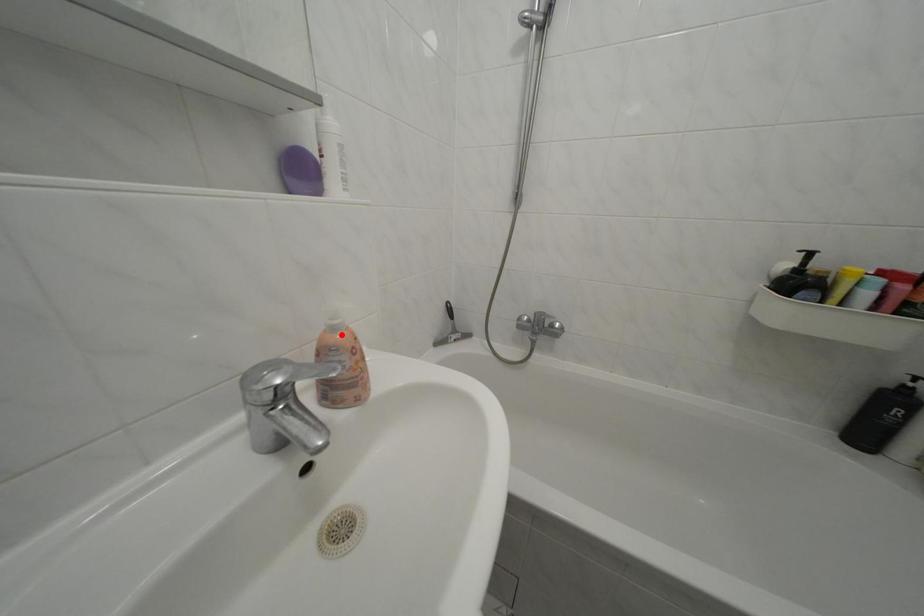
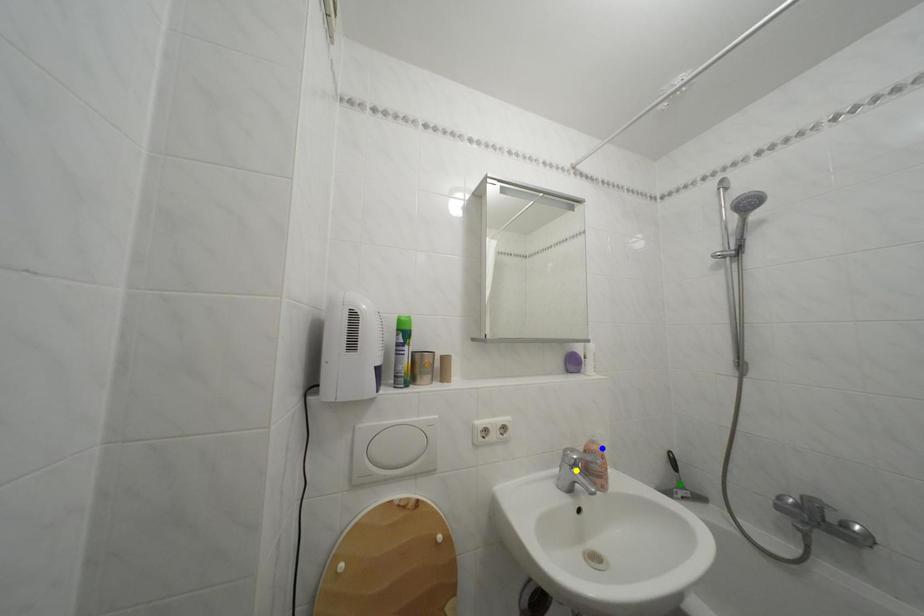
Question: I am providing you with two images of the same scene from different viewpoints. A red point is marked on the first image. You are given multiple points on the second image. Which spot in image 2 lines up with the point in image 1?

Choices:
 (A) blue point
 (B) green point
 (C) yellow point

Answer: (A)